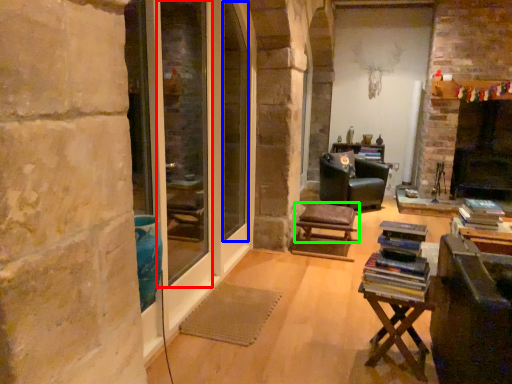
Question: Which is farther away from screen door (highlighted by a red box)? window screen (highlighted by a blue box) or stool (highlighted by a green box)?

Choices:
 (A) window screen
 (B) stool

Answer: (B)